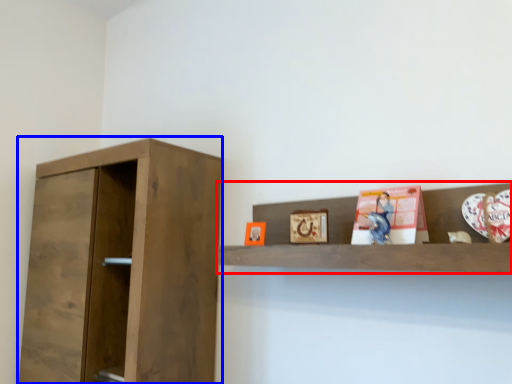
Question: Among these objects, which one is nearest to the camera, shelf (highlighted by a red box) or cupboard (highlighted by a blue box)?

Choices:
 (A) shelf
 (B) cupboard

Answer: (A)